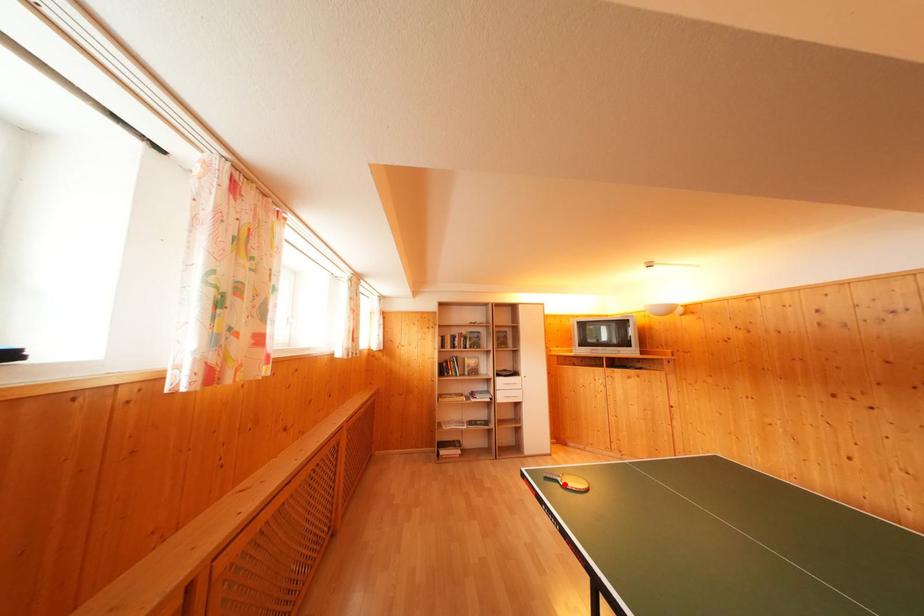
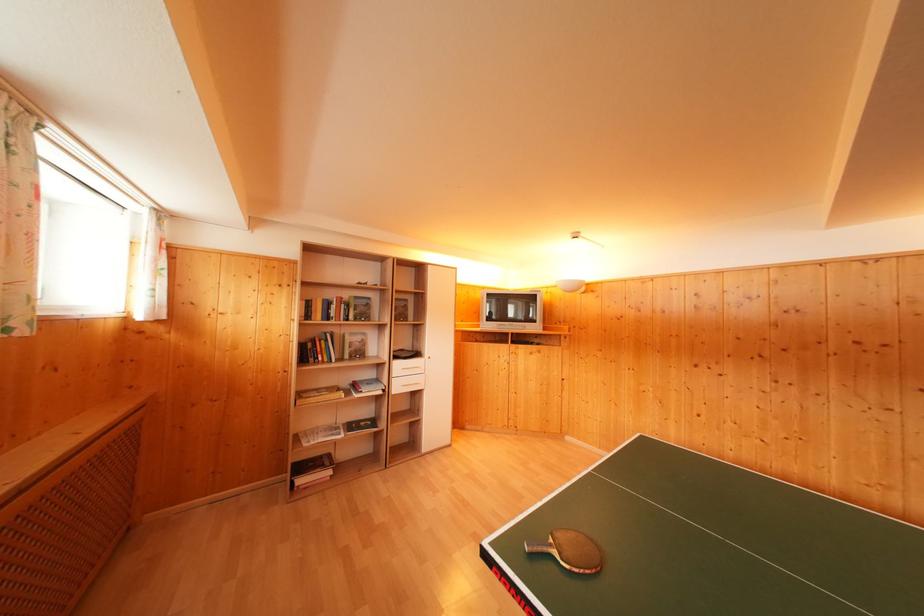
Find the pixel in the second image that matches the highlighted location in the first image.

(561, 557)